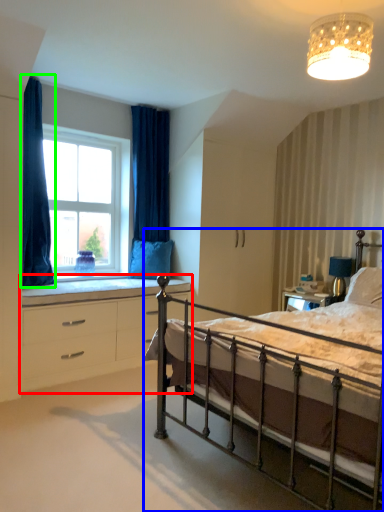
Question: Considering the real-world distances, which object is farthest from chest of drawers (highlighted by a red box)? bed (highlighted by a blue box) or curtain (highlighted by a green box)?

Choices:
 (A) bed
 (B) curtain

Answer: (A)